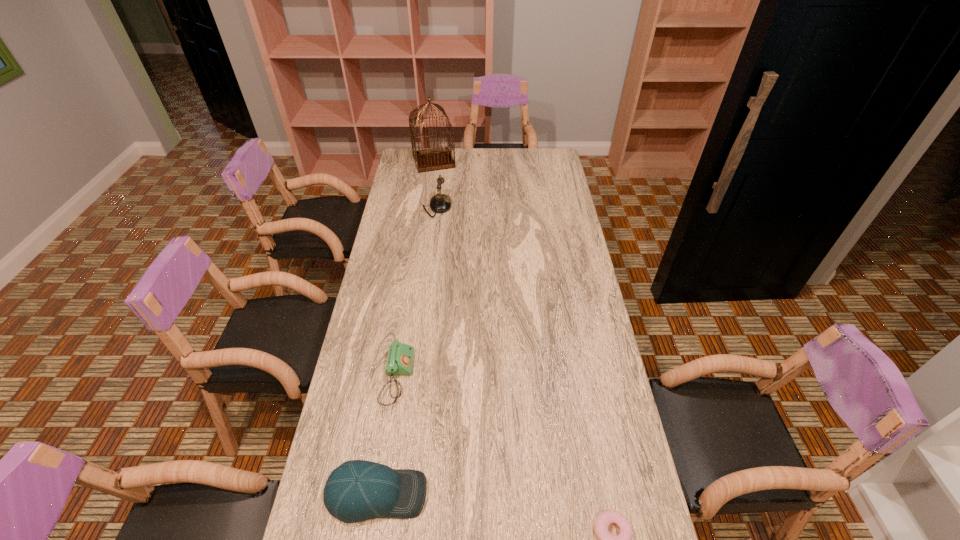
Find the location of a particular element. This screenshot has height=540, width=960. birdcage is located at coordinates (433, 159).

Identify the location of the farthest object. This screenshot has height=540, width=960. (433, 159).

At what (x,y) coordinates should I click in order to perform the action: click on the second tallest object. Please return your answer as a coordinate pair (x, y). The height and width of the screenshot is (540, 960). Looking at the image, I should click on (440, 203).

Locate an element on the screen. The width and height of the screenshot is (960, 540). the second farthest object is located at coordinates (440, 203).

At what (x,y) coordinates should I click in order to perform the action: click on baseball cap. Please return your answer as a coordinate pair (x, y). The height and width of the screenshot is (540, 960). Looking at the image, I should click on (358, 490).

This screenshot has height=540, width=960. Find the location of `the shorter telephone`. the shorter telephone is located at coordinates (400, 356).

Locate an element on the screen. This screenshot has height=540, width=960. the third farthest object is located at coordinates (400, 356).

The height and width of the screenshot is (540, 960). Find the location of `free space located on the front of the birdcage`. free space located on the front of the birdcage is located at coordinates (428, 202).

The width and height of the screenshot is (960, 540). In order to click on free space located 0.200m on the dial of the second tallest object in this screenshot , I will do `click(495, 207)`.

This screenshot has width=960, height=540. I want to click on vacant region located on the right of the third tallest object, so click(467, 494).